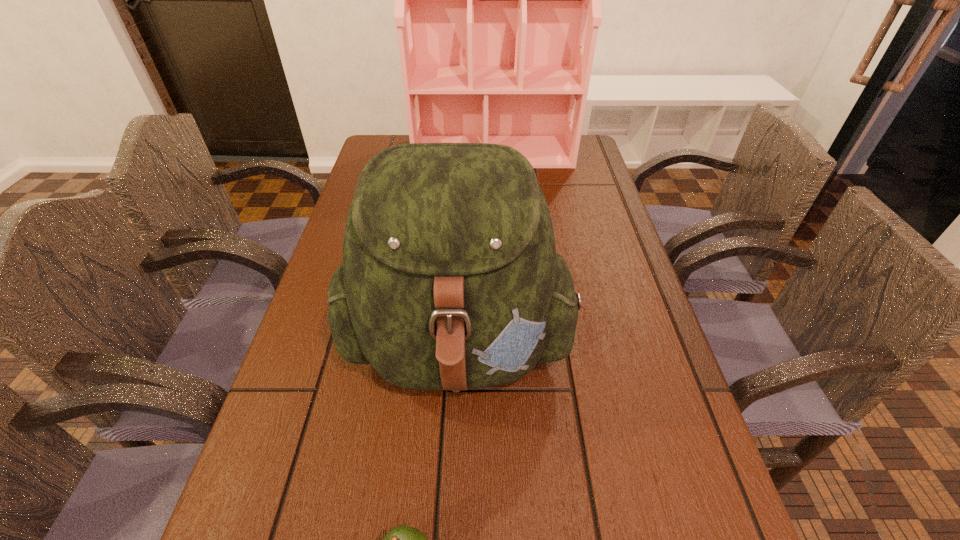
This screenshot has height=540, width=960. What are the coordinates of `the tallest object` in the screenshot? It's located at (497, 0).

I want to click on dollhouse, so click(497, 0).

This screenshot has width=960, height=540. What are the coordinates of `the second shortest object` in the screenshot? It's located at (450, 279).

Locate an element on the screen. backpack is located at coordinates (450, 279).

This screenshot has height=540, width=960. I want to click on vacant space located on the front-facing side of the dollhouse, so click(x=496, y=209).

Locate an element on the screen. This screenshot has height=540, width=960. free space located 0.100m on the open flap of the second shortest object is located at coordinates (454, 497).

Identify the location of object at the far edge. (497, 0).

Find the location of a particular element. The image size is (960, 540). dollhouse present at the left edge is located at coordinates (497, 0).

The width and height of the screenshot is (960, 540). In order to click on backpack that is at the left edge in this screenshot , I will do click(450, 279).

Locate an element on the screen. This screenshot has height=540, width=960. object present at the right edge is located at coordinates (497, 0).